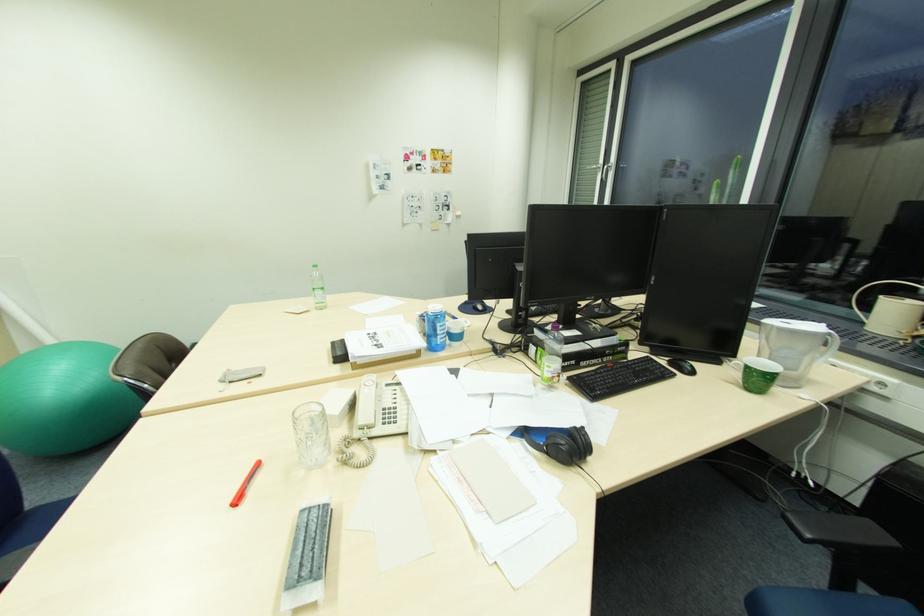
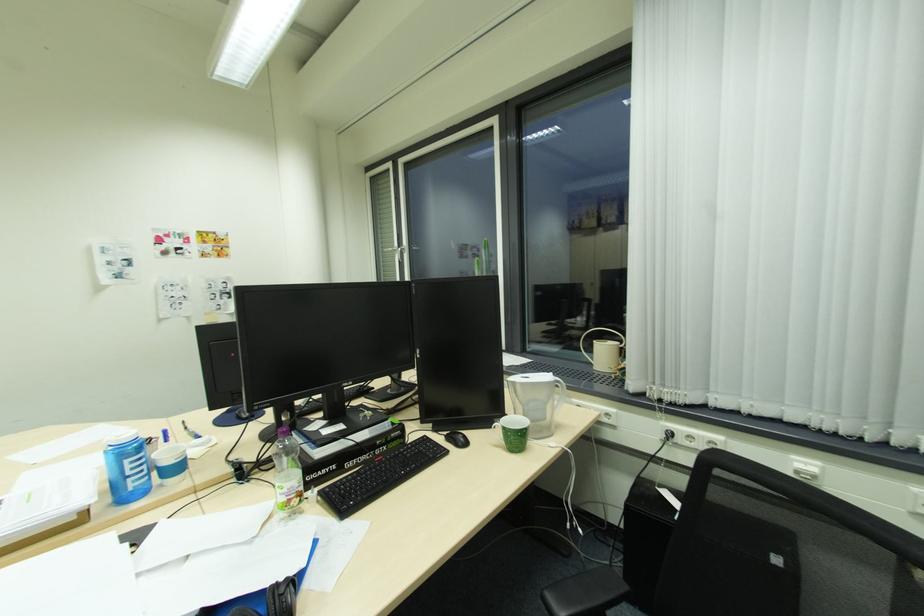
Question: The images are taken continuously from a first-person perspective. In which direction is your viewpoint rotating?

Choices:
 (A) Left
 (B) Right
 (C) Up
 (D) Down

Answer: (B)